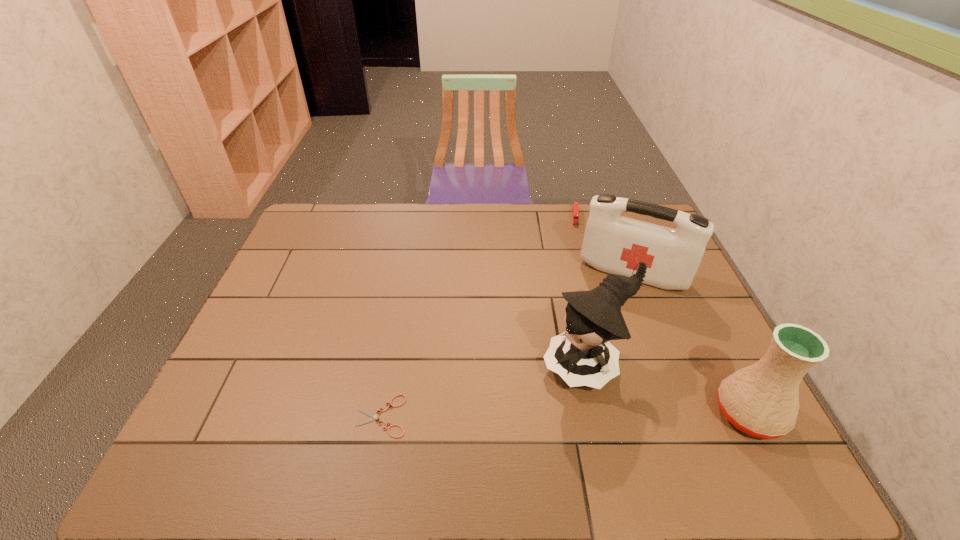
This screenshot has height=540, width=960. I want to click on free region located on the front-facing side of the stapler, so click(577, 300).

This screenshot has height=540, width=960. What are the coordinates of `vacant space located on the front-facing side of the stapler` in the screenshot? It's located at tap(577, 279).

Find the location of a particular element. vacant space located 0.290m on the front side of the first-aid kit is located at coordinates (590, 366).

Locate an element on the screen. vacant space located 0.220m on the front side of the first-aid kit is located at coordinates (597, 346).

At what (x,y) coordinates should I click in order to perform the action: click on vacant point located on the front side of the first-aid kit. Please return your answer as a coordinate pair (x, y). Looking at the image, I should click on (605, 326).

You are a GUI agent. You are given a task and a screenshot of the screen. Output one action in this format:
    pyautogui.click(x=<x>, y=<y>)
    Task: Click on the vacant position located at the face of the doll
    The width and height of the screenshot is (960, 540).
    Given the screenshot: What is the action you would take?
    pyautogui.click(x=499, y=423)

Where is `free region located at the face of the doll`? The height and width of the screenshot is (540, 960). free region located at the face of the doll is located at coordinates (516, 411).

Locate an element on the screen. This screenshot has width=960, height=540. free space located at the face of the doll is located at coordinates (539, 396).

This screenshot has width=960, height=540. Identify the location of object positioned at the far edge. tap(575, 210).

At what (x,y) coordinates should I click in order to perform the action: click on shears that is at the near edge. Please return your answer as a coordinate pair (x, y). Image resolution: width=960 pixels, height=540 pixels. Looking at the image, I should click on (373, 416).